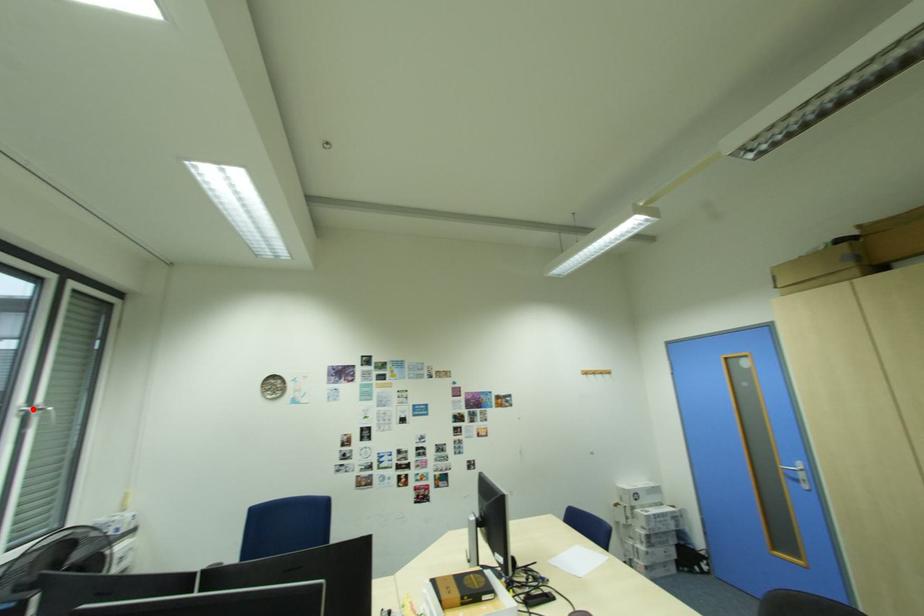
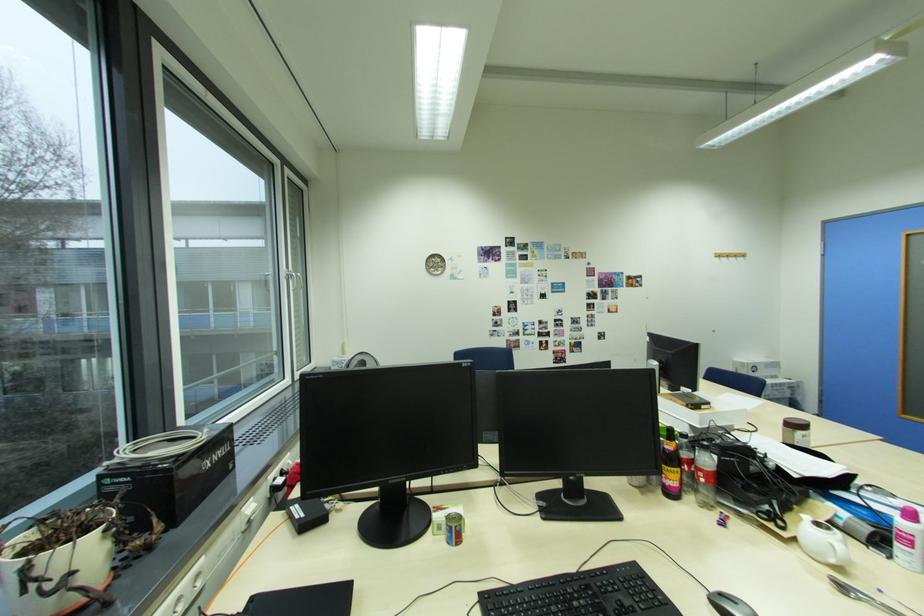
Locate, in the second image, the point that corresponds to the highlighted location in the first image.

(296, 274)